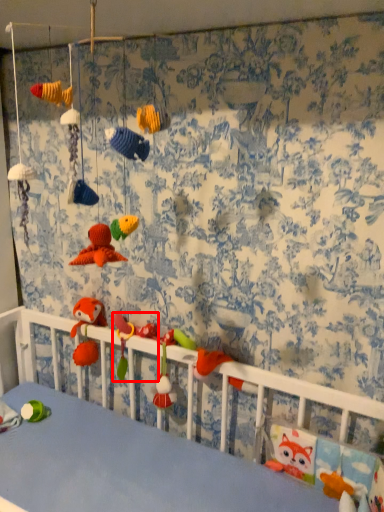
Question: From the image's perspective, considering the relative positions of toy (annotated by the red box) and toy in the image provided, where is toy (annotated by the red box) located with respect to the staircase?

Choices:
 (A) below
 (B) above

Answer: (B)